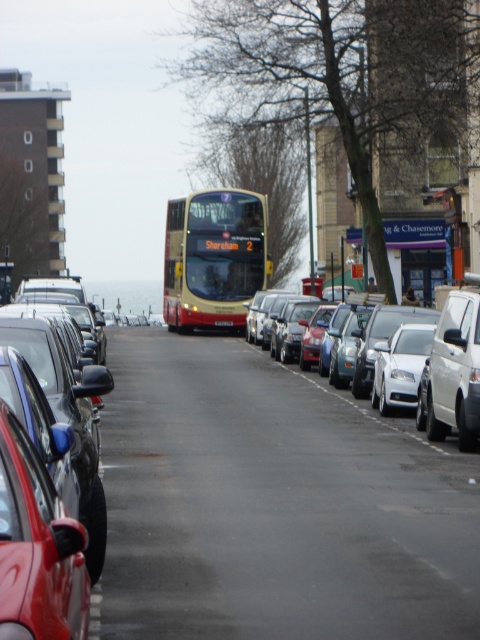
Does white glossy car at center appear on the left side of gold metallic bus at center?

No, white glossy car at center is not to the left of gold metallic bus at center.

Measure the distance between white glossy car at center and camera.

white glossy car at center is 16.89 meters from camera.

Where is `white glossy car at center`? The image size is (480, 640). white glossy car at center is located at coordinates (456, 369).

Which is above, shiny black car at left or gold metallic bus at center?

shiny black car at left

Can you confirm if shiny black car at left is smaller than gold metallic bus at center?

Incorrect, shiny black car at left is not smaller in size than gold metallic bus at center.

The image size is (480, 640). Describe the element at coordinates (66, 349) in the screenshot. I see `shiny black car at left` at that location.

The image size is (480, 640). I want to click on shiny black car at left, so click(66, 349).

Between gold/yellow metallic bus at center and white glossy car at center, which one is positioned lower?

white glossy car at center is lower down.

Can you confirm if gold/yellow metallic bus at center is positioned below white glossy car at center?

No.

The width and height of the screenshot is (480, 640). Describe the element at coordinates (214, 257) in the screenshot. I see `gold/yellow metallic bus at center` at that location.

The width and height of the screenshot is (480, 640). What are the coordinates of `gold/yellow metallic bus at center` in the screenshot? It's located at (214, 257).